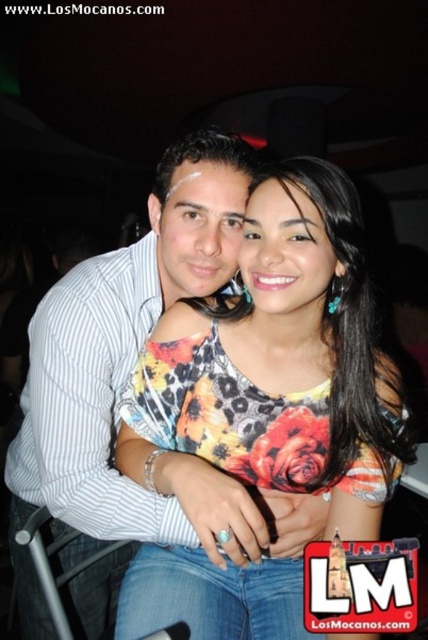
Question: Is floral printed top at center to the right of white striped shirt at center from the viewer's perspective?

Choices:
 (A) no
 (B) yes

Answer: (B)

Question: Does floral printed top at center have a lesser width compared to white striped shirt at center?

Choices:
 (A) yes
 (B) no

Answer: (A)

Question: Which object appears closest to the camera in this image?

Choices:
 (A) floral printed top at center
 (B) white striped shirt at center

Answer: (A)

Question: Is floral printed top at center smaller than white striped shirt at center?

Choices:
 (A) no
 (B) yes

Answer: (B)